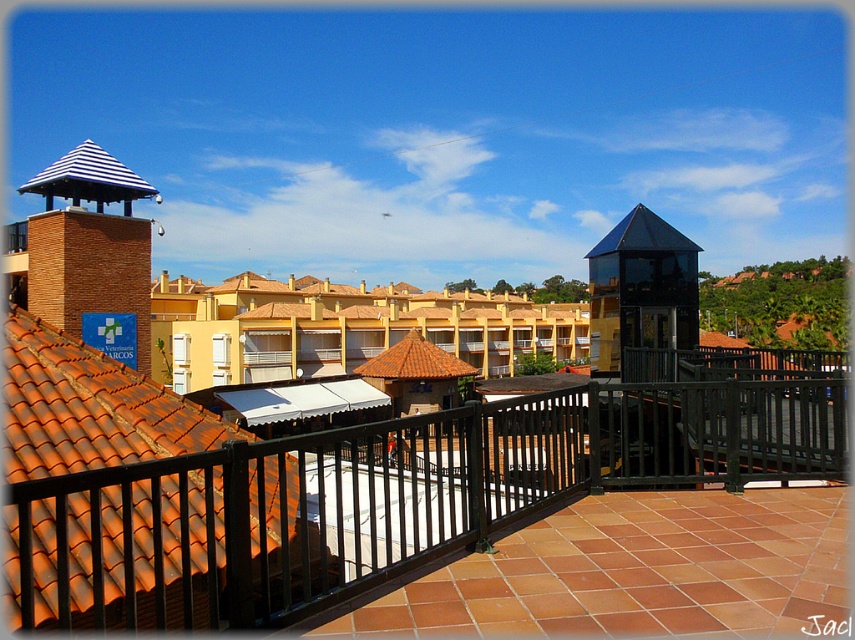
You are standing on the rooftop and want to locate the orange tile roof at upper left. What are its coordinates in the image?

The orange tile roof at upper left is located at coordinates point (87, 408).